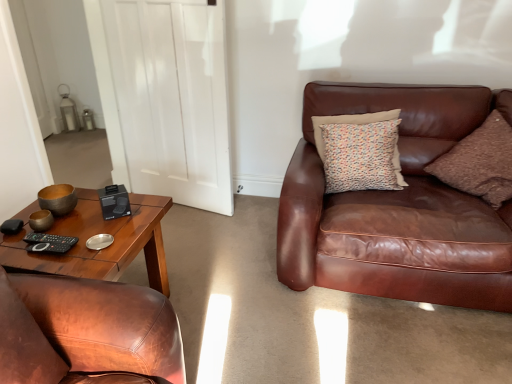
In order to click on empty space that is in between brown leather chair at left and brown leather couch at right in this screenshot , I will do `click(281, 311)`.